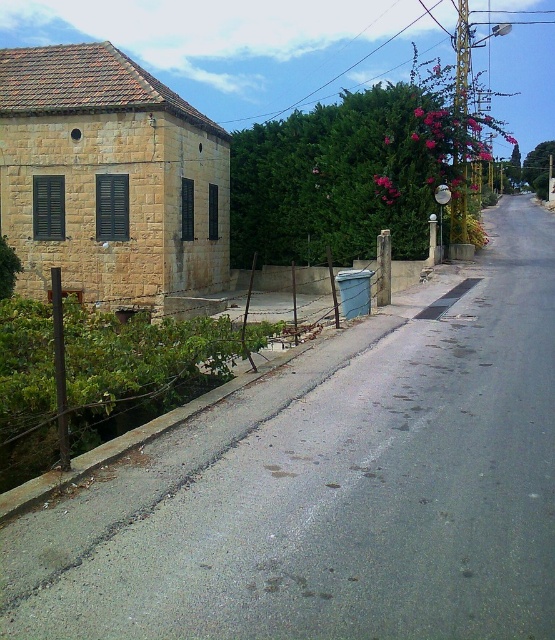
Can you confirm if gray asphalt road at center is bigger than yellow stone building at left?

No.

This screenshot has width=555, height=640. Identify the location of gray asphalt road at center. (344, 492).